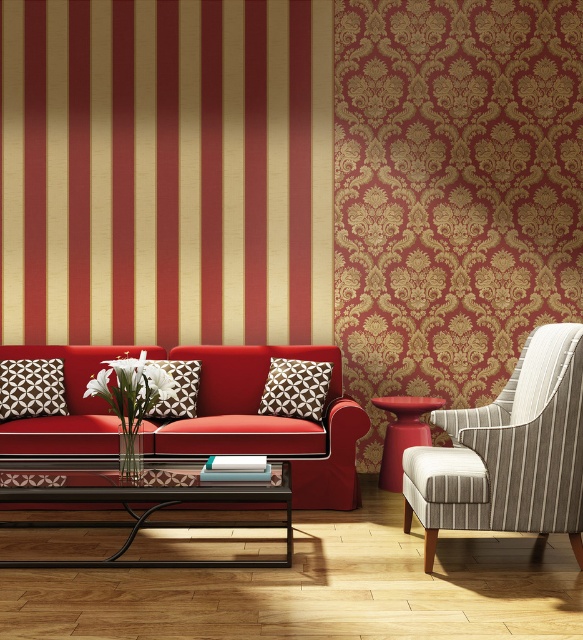
Is matte red sofa at center to the right of matte white pillow with geometric pattern at center from the viewer's perspective?

In fact, matte red sofa at center is to the left of matte white pillow with geometric pattern at center.

Does matte red sofa at center appear under matte white pillow with geometric pattern at center?

Yes.

Is point (359, 429) farther from camera compared to point (329, 371)?

No.

Identify the location of matte red sofa at center. (x=268, y=422).

Is striped fabric armchair at right closer to the viewer compared to matte white pillow with geometric pattern at center?

That is True.

Can you confirm if striped fabric armchair at right is thinner than matte white pillow with geometric pattern at center?

In fact, striped fabric armchair at right might be wider than matte white pillow with geometric pattern at center.

Between point (433, 467) and point (301, 378), which one is positioned in front?

Point (433, 467) is more forward.

This screenshot has width=583, height=640. Identify the location of striped fabric armchair at right. click(510, 451).

Can you confirm if matte red sofa at center is shorter than metallic black coffee table at lower center?

No.

The width and height of the screenshot is (583, 640). In order to click on matte red sofa at center in this screenshot , I will do `click(268, 422)`.

Which is behind, point (96, 444) or point (27, 564)?

Positioned behind is point (96, 444).

Where is `matte red sofa at center`? This screenshot has width=583, height=640. matte red sofa at center is located at coordinates (268, 422).